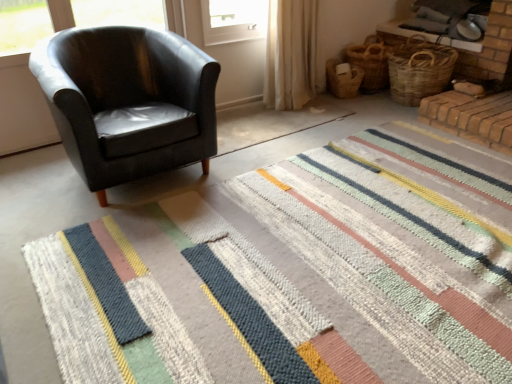
You are a GUI agent. You are given a task and a screenshot of the screen. Output one action in this format:
    pyautogui.click(x=<x>, y=<y>)
    Task: Click on the vacant space in front of woven straw basket at right, which is counted as the 1th basket, starting from the left
    
    Given the screenshot: What is the action you would take?
    pyautogui.click(x=359, y=107)